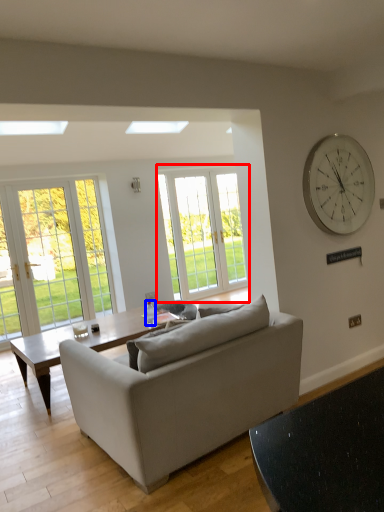
Question: Which object appears farthest to the camera in this image, window (highlighted by a red box) or bottle (highlighted by a blue box)?

Choices:
 (A) window
 (B) bottle

Answer: (A)